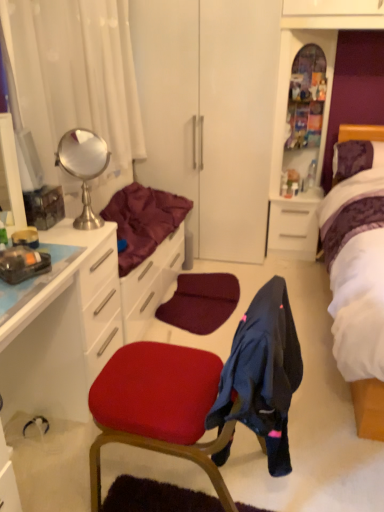
Question: Is point (266, 336) closer or farther from the camera than point (264, 402)?

Choices:
 (A) closer
 (B) farther

Answer: (A)

Question: From the image's perspective, relative to matte red chair at center, is dark blue fabric at center above or below?

Choices:
 (A) below
 (B) above

Answer: (B)

Question: Which of these objects is positioned farthest from the maroon fabric at left?

Choices:
 (A) polished silver mirror at upper left
 (B) purple satin bed at right
 (C) white glossy cabinet at left
 (D) matte red chair at center
 (E) dark blue fabric at center

Answer: (B)

Question: Which object is the closest to the dark blue fabric at center?

Choices:
 (A) white fabric curtain at left
 (B) translucent glass cabinet at upper center, positioned as the second file cabinet in bottom-to-top order
 (C) purple satin bed at right
 (D) matte red chair at center
 (E) white glossy file cabinet at center right, the 1th file cabinet from the bottom

Answer: (D)